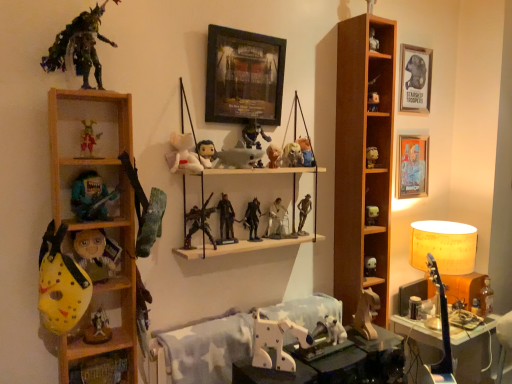
This screenshot has height=384, width=512. I want to click on free space behind white matte wooden dog at lower center, acting as the 23th toy starting from the top, so click(x=298, y=349).